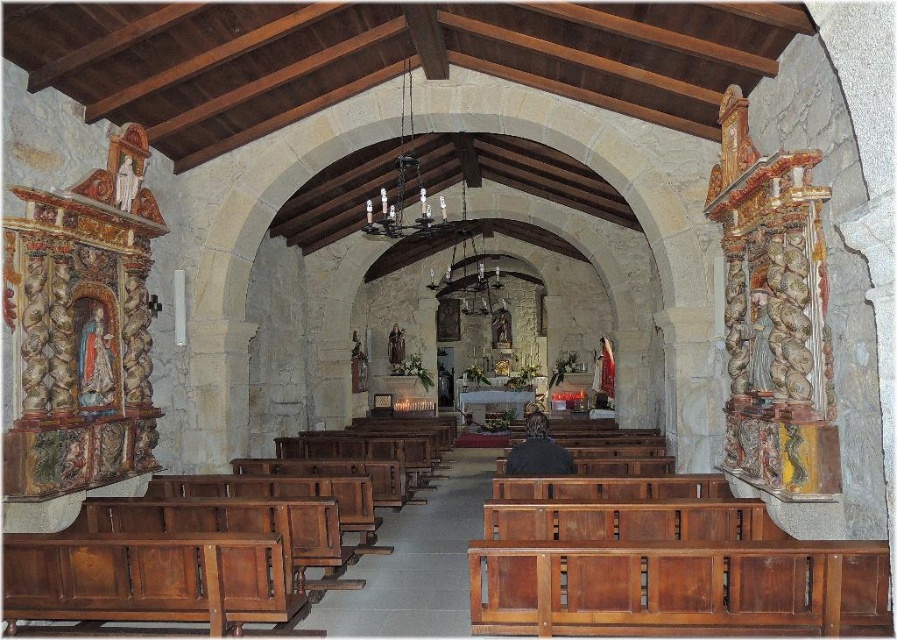
You are standing at the entrance of the church and notice a dark brown leather jacket at center. Where would you find this jacket in relation to the pews on the left side?

The dark brown leather jacket at center is located at point [538,452], which is further to the right compared to the pews on the left side. Therefore, the jacket is positioned to the right of the left pews.

You are standing at the entrance of the church and see the dark brown leather jacket at center and the matte white statue at left. You want to place a 10 feet long banner between them. Is there enough space?

The dark brown leather jacket at center and matte white statue at left are 12.82 feet apart, so yes, the banner can be placed between them since the distance is longer than the banner.

You are standing in the church and want to take a photo of both point [94,320] and point [507,456]. Which point should you focus on first to ensure both are in clear view?

Point [94,320] is closer to the camera than point [507,456], so you should focus on point [94,320] first to ensure both are in clear view.